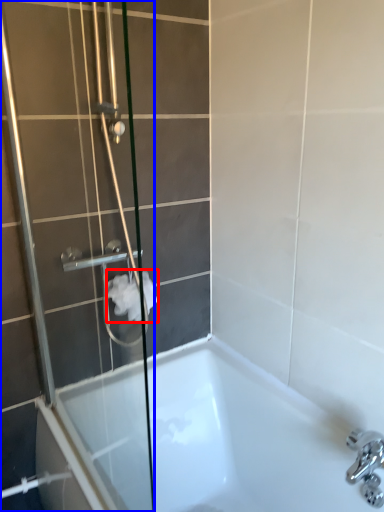
Question: Which object appears closest to the camera in this image, toilet paper (highlighted by a red box) or shower door (highlighted by a blue box)?

Choices:
 (A) toilet paper
 (B) shower door

Answer: (B)